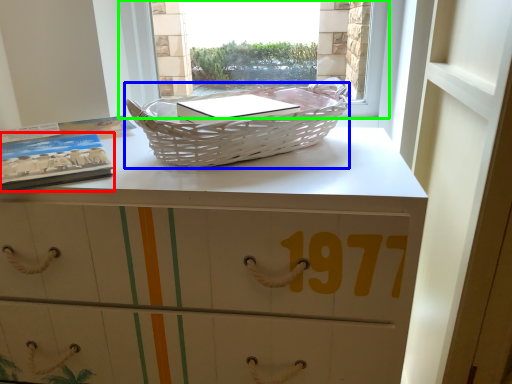
Question: Which object is the farthest from paperback book (highlighted by a red box)? Choose among these: picnic basket (highlighted by a blue box) or window (highlighted by a green box).

Choices:
 (A) picnic basket
 (B) window

Answer: (B)